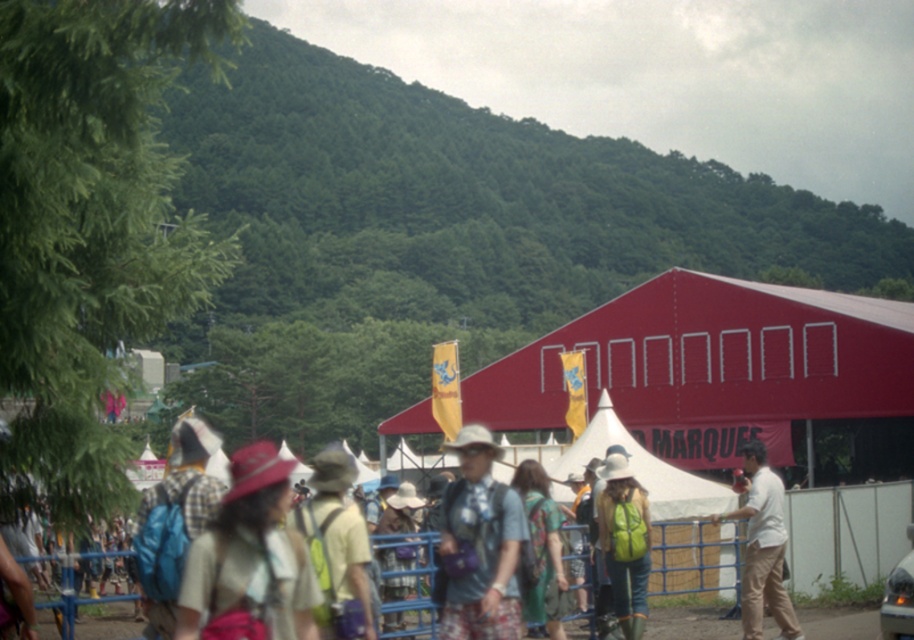
Which is behind, point (466, 596) or point (629, 611)?

The point (629, 611) is behind.

Which is more to the left, matte gray shirt at center or green matte backpack at center?

matte gray shirt at center

Is point (473, 593) in front of point (602, 545)?

Yes, it is.

Image resolution: width=914 pixels, height=640 pixels. Find the location of `matte gray shirt at center`. matte gray shirt at center is located at coordinates (480, 545).

How distant is white cotton shirt at center from blue backpack at left?

white cotton shirt at center is 34.21 feet from blue backpack at left.

Is white cotton shirt at center above blue backpack at left?

Incorrect, white cotton shirt at center is not positioned above blue backpack at left.

Who is more forward, (785, 616) or (182, 483)?

Point (182, 483) is more forward.

Where is `white cotton shirt at center`? white cotton shirt at center is located at coordinates (762, 547).

Who is more forward, (267, 628) or (619, 506)?

Point (267, 628)

Who is shorter, matte pink hat at center or green matte backpack at center?

green matte backpack at center

In order to click on matte pink hat at center in this screenshot , I will do `click(250, 561)`.

Identify the location of matte pink hat at center. (250, 561).